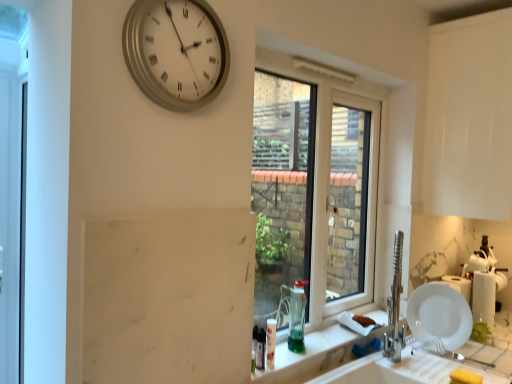
Question: From their relative heights in the image, would you say green glass at lower center is taller or shorter than white plastic window at center?

Choices:
 (A) short
 (B) tall

Answer: (A)

Question: In the image, is green glass at lower center positioned in front of or behind white plastic window at center?

Choices:
 (A) behind
 (B) front

Answer: (B)

Question: Which object is the farthest from the yellow sponge at lower right?

Choices:
 (A) silver metallic clock at upper center
 (B) white plastic window at center
 (C) white glossy plate at lower right
 (D) green glass at lower center
 (E) green glass bottle at window

Answer: (B)

Question: Which of these objects is positioned farthest from the green glass at lower center?

Choices:
 (A) yellow sponge at lower right
 (B) white plastic window at center
 (C) green glass bottle at window
 (D) silver metallic clock at upper center
 (E) white glossy plate at lower right

Answer: (B)